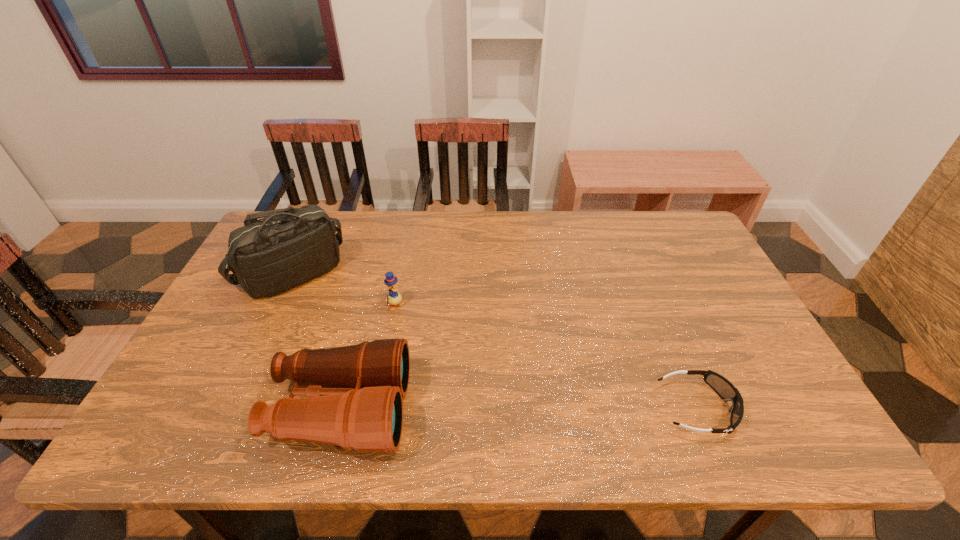
What are the coordinates of `unoccupied position between the second shortest object and the shoulder bag` in the screenshot? It's located at (345, 289).

Where is `vacant region between the shoulder bag and the duckling`? This screenshot has width=960, height=540. vacant region between the shoulder bag and the duckling is located at coordinates (345, 289).

I want to click on free spot between the tallest object and the duckling, so click(x=345, y=289).

Select which object is the third closest to the binoculars. Please provide its 2D coordinates. Your answer should be formatted as a tuple, i.e. [(x, y)], where the tuple contains the x and y coordinates of a point satisfying the conditions above.

[(724, 388)]

Identify which object is the nearest to the tallest object. Please provide its 2D coordinates. Your answer should be formatted as a tuple, i.e. [(x, y)], where the tuple contains the x and y coordinates of a point satisfying the conditions above.

[(394, 298)]

Identify the location of vacant region that satisfies the following two spatial constraints: 1. on the front side of the shoulder bag; 2. on the front and sides of the rightmost object. (228, 408).

Where is `vacant space that satisfies the following two spatial constraints: 1. on the front side of the rightmost object; 2. on the front and sides of the second shortest object`? vacant space that satisfies the following two spatial constraints: 1. on the front side of the rightmost object; 2. on the front and sides of the second shortest object is located at coordinates (375, 408).

The width and height of the screenshot is (960, 540). I want to click on vacant space that satisfies the following two spatial constraints: 1. on the front side of the shoulder bag; 2. on the left side of the duckling, so click(x=277, y=306).